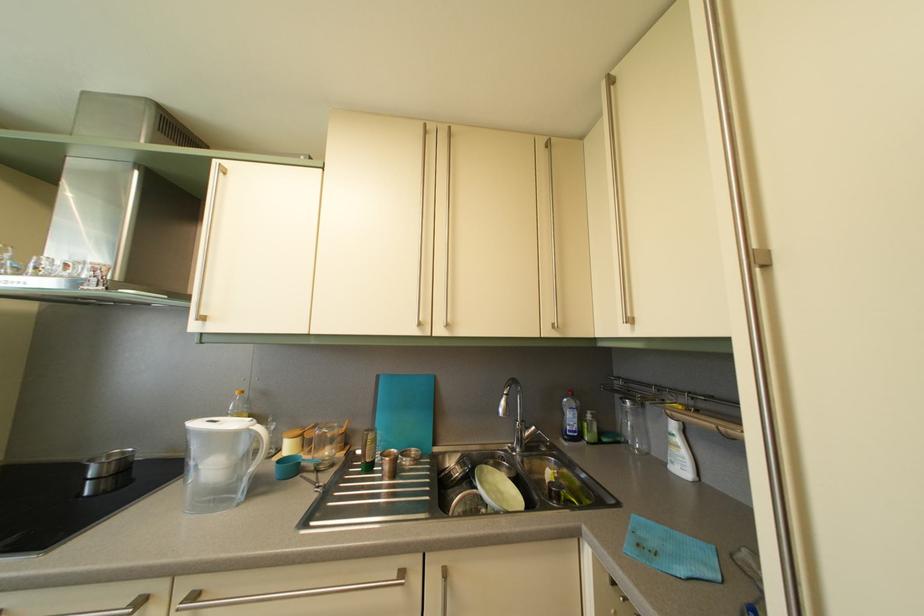
Image resolution: width=924 pixels, height=616 pixels. What do you see at coordinates (254, 456) in the screenshot? I see `the pitcher handle` at bounding box center [254, 456].